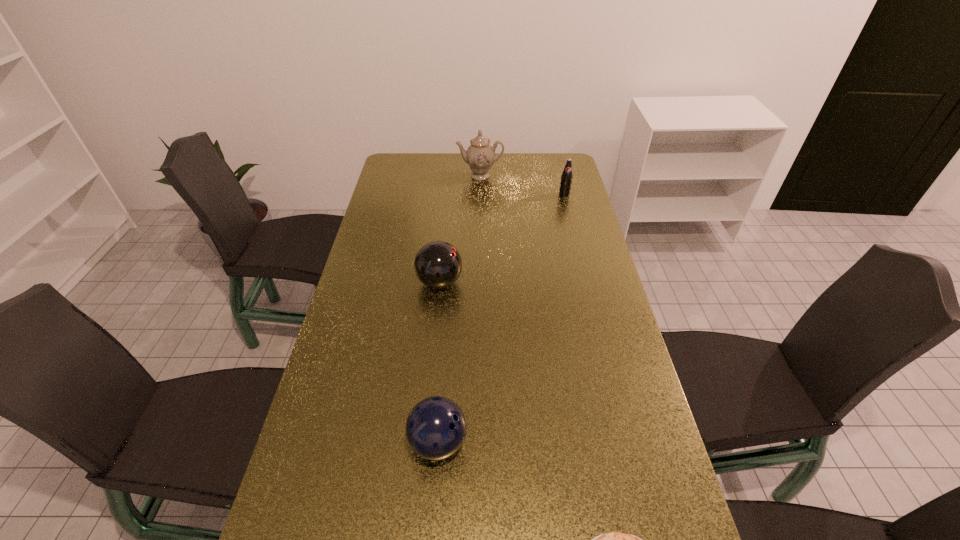
The width and height of the screenshot is (960, 540). I want to click on vacant area between the second nearest object and the fourth nearest object, so click(x=501, y=319).

Locate an element on the screen. The image size is (960, 540). free space between the pop and the third nearest object is located at coordinates (502, 238).

This screenshot has height=540, width=960. What are the coordinates of `free space between the farther bowling ball and the chinaware` in the screenshot? It's located at (460, 229).

Find the location of a particular element. free area in between the third farthest object and the chinaware is located at coordinates (460, 229).

Where is `object that ranks as the closest to the tallest object`? The width and height of the screenshot is (960, 540). object that ranks as the closest to the tallest object is located at coordinates (566, 178).

The height and width of the screenshot is (540, 960). Find the location of `object that stands as the closest to the fourth farthest object`. object that stands as the closest to the fourth farthest object is located at coordinates [x=615, y=539].

The image size is (960, 540). I want to click on free space that satisfies the following two spatial constraints: 1. on the front label of the pop; 2. on the surface of the nearer bowling ball near the finger holes, so click(628, 442).

Identify the location of free location that satisfies the following two spatial constraints: 1. on the spout of the tallest object; 2. on the surface of the nearer bowling ball near the finger holes. (480, 442).